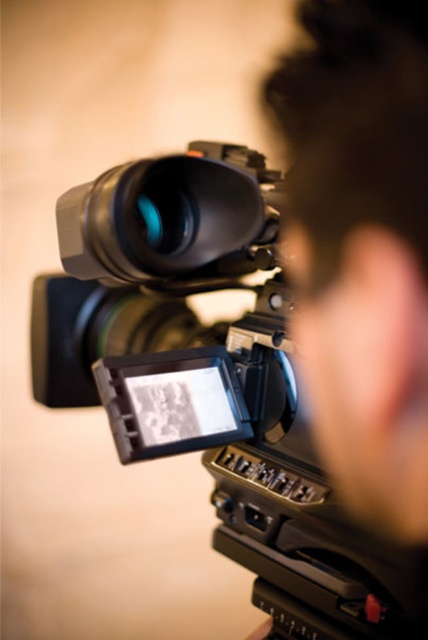
You are a videographer setting up a camera for a shoot. You need to place a new camera at point [211,380]. Is there already a camera at that location?

Yes, there is already a black plastic camera at center located at point [211,380].

You are a photographer setting up equipment. You notice the black plastic camera at center and the matte black lens at center. Which object is closer to you when you look through the camera?

The black plastic camera at center is closer to you than the matte black lens at center when you look through the camera.

You are a videographer setting up equipment. You have a black plastic camera at center and a matte black lens at center. Which object is taller?

The black plastic camera at center is taller than the matte black lens at center.